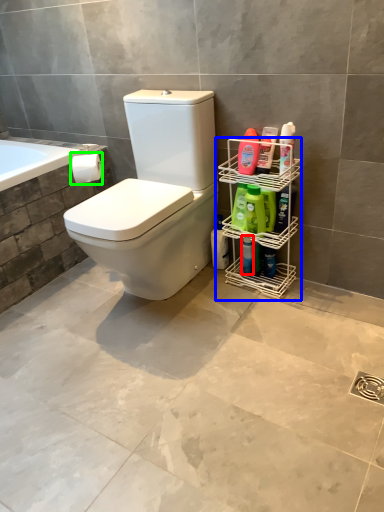
Question: Estimate the real-world distances between objects in this image. Which object is closer to cleaning product (highlighted by a red box), porcelain (highlighted by a blue box) or toilet paper (highlighted by a green box)?

Choices:
 (A) porcelain
 (B) toilet paper

Answer: (A)